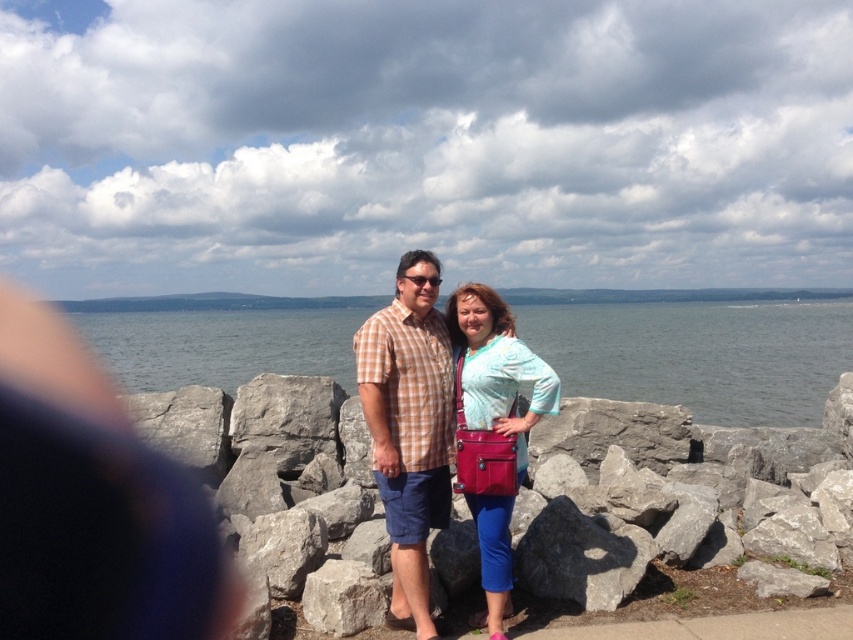
Question: Can you confirm if gray water at center is positioned below checkered fabric shirt at center?

Choices:
 (A) yes
 (B) no

Answer: (B)

Question: Can you confirm if gray water at center is bigger than checkered fabric shirt at center?

Choices:
 (A) no
 (B) yes

Answer: (B)

Question: Which of the following is the farthest from the observer?

Choices:
 (A) gray water at center
 (B) matte pink purse at center
 (C) checkered fabric shirt at center

Answer: (A)

Question: Is matte pink purse at center smaller than gray rough rock at center?

Choices:
 (A) yes
 (B) no

Answer: (B)

Question: Which of the following is the closest to the observer?

Choices:
 (A) checkered fabric shirt at center
 (B) gray water at center
 (C) matte pink purse at center
 (D) gray rough rock at center

Answer: (C)

Question: Which point is closer to the camera taking this photo?

Choices:
 (A) (518, 572)
 (B) (402, 621)
 (C) (462, 308)
 (D) (612, 346)

Answer: (B)